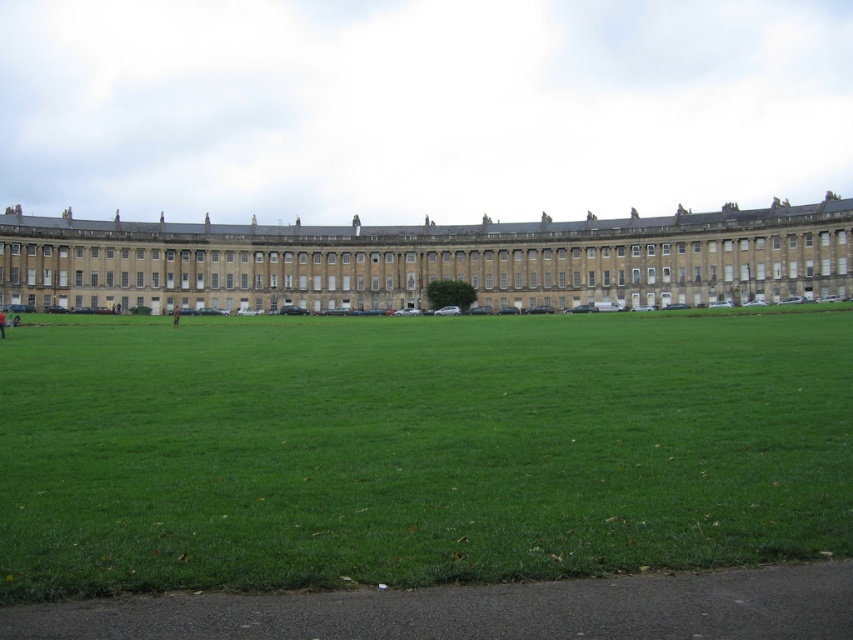
You are planning to set up a picnic blanket on the green grass at center. Considering the beige stone palace at center is nearby, will the palace block the sunlight reaching the grass? Please explain based on their widths.

The green grass at center has a smaller width than the beige stone palace at center. Since the palace is wider, it could cast a larger shadow over the grass area, potentially blocking sunlight depending on the time of day and angle of the sun.

You are standing at the origin point in the image. Which direction should you move to reach the green grass at center?

The green grass at center is located at point (418, 449), so you should move towards the center of the image to reach it.